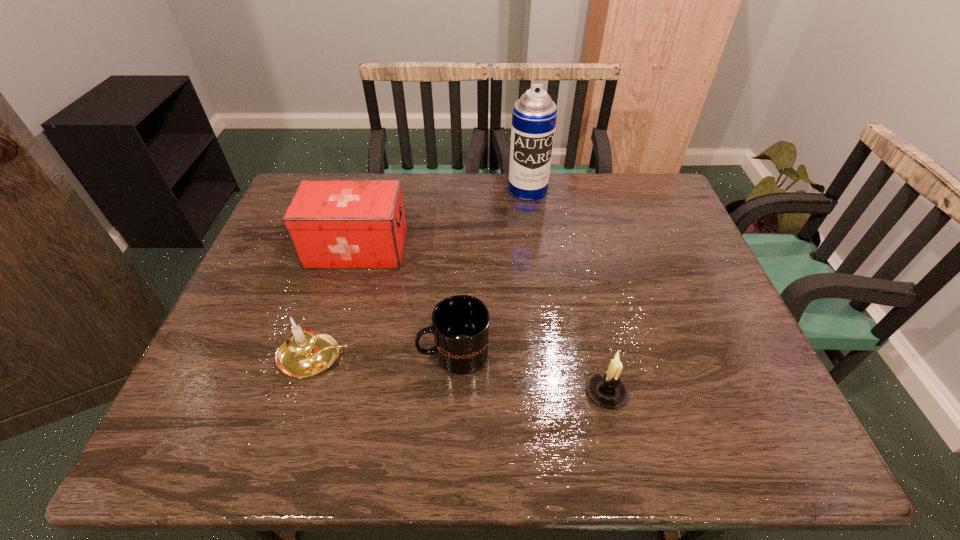
At what (x,y) coordinates should I click in order to perform the action: click on aerosol can. Please return your answer as a coordinate pair (x, y). This screenshot has height=540, width=960. Looking at the image, I should click on (534, 115).

The height and width of the screenshot is (540, 960). In order to click on the second object from right to left in this screenshot , I will do `click(534, 115)`.

Find the location of `the first-aid kit`. the first-aid kit is located at coordinates (333, 224).

Image resolution: width=960 pixels, height=540 pixels. Find the location of `the second tallest object`. the second tallest object is located at coordinates (333, 224).

I want to click on the left candle holder, so click(305, 353).

I want to click on the rightmost object, so click(x=607, y=389).

The image size is (960, 540). I want to click on the third object from right to left, so click(460, 324).

I want to click on free space located 0.060m on the label side of the tallest object, so click(x=531, y=213).

This screenshot has height=540, width=960. I want to click on free space located 0.380m on the handle side of the first-aid kit, so click(x=540, y=249).

The width and height of the screenshot is (960, 540). Identify the location of free spot located on the handle side of the left candle holder. (488, 357).